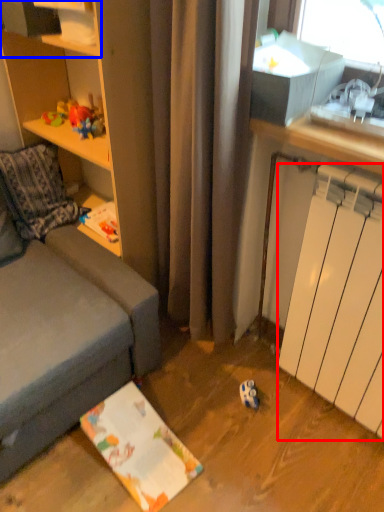
Question: Which point is further to the camera, radiator (highlighted by a red box) or shelf (highlighted by a blue box)?

Choices:
 (A) radiator
 (B) shelf

Answer: (B)